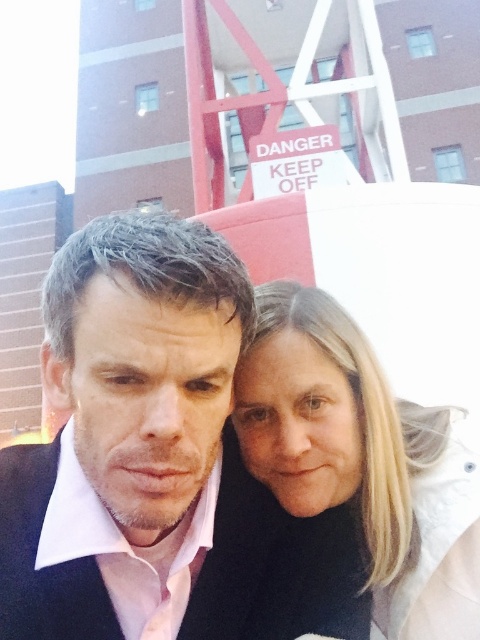
You are a photographer trying to capture a clear shot of the black matte jacket at center. Given that your camera has a focal length of 50mm and you are positioned 3 meters away from the jacket, can you estimate the approximate size of the jacket in millimeters using the formula size_at_sensor_mm equals focal_length_mm multiplied by object_distance_m divided by object_size_m? Wait, but I might have mixed up the formula. Let me think. Hmm, actually, the correct formula for calculating the size of an object.

The question contains an incorrect formula. The correct formula to calculate the size of an object on the sensor is size_at_sensor_mm equals focal_length_mm multiplied by object_size_m divided by object_distance_m. However, without knowing the actual size of the black matte jacket at center, we cannot compute the exact size at the sensor. Please provide the jacket size in meters to proceed.

You are a photographer trying to adjust the lighting for a portrait. You notice the black matte jacket at center and the blonde hair at center. Which object should you focus on if you want to highlight something taller in the scene?

The black matte jacket at center is taller than the blonde hair at center, so focusing on it would highlight the taller object.

You are standing at the point marked as point (51, 614) and want to take a photo of the two people in the scene. Given that your camera has a maximum focus range of 12 meters, will you be able to capture them clearly?

The distance of point (51, 614) from viewer is 13.22 meters, which exceeds the camera maximum focus range of 12 meters. Therefore, you cannot capture them clearly.